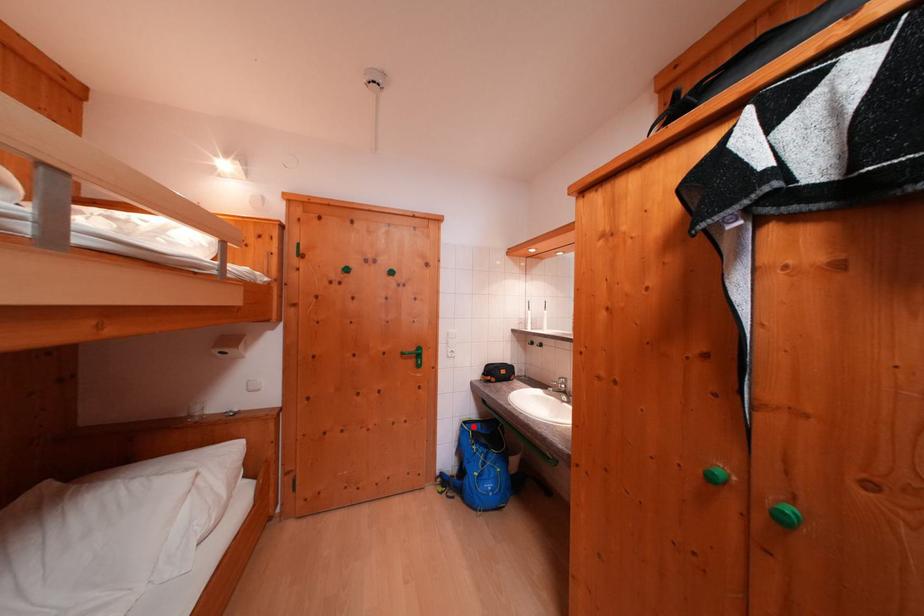
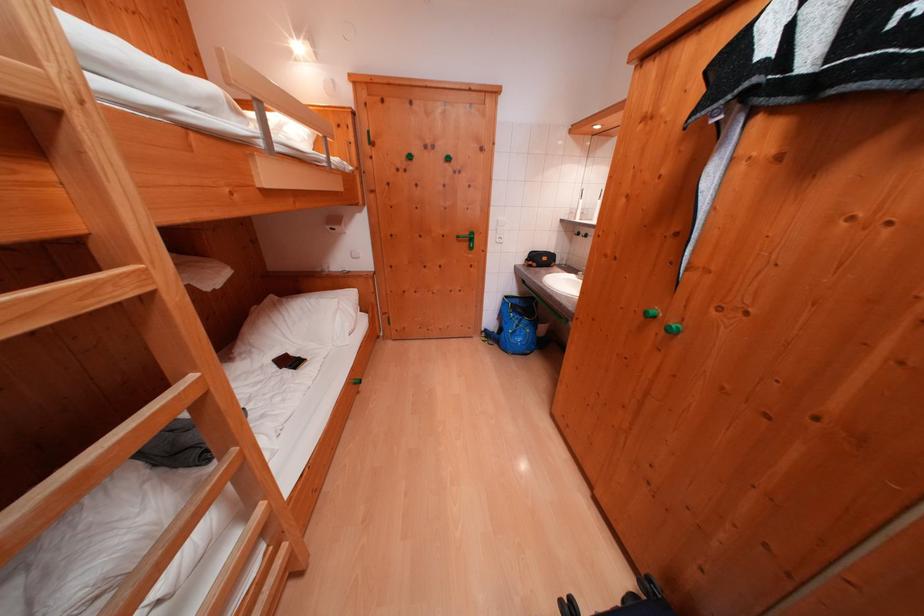
Question: A red point is marked in image1. In image2, is the corresponding 3D point closer to the camera or farther? Reply with the corresponding letter.

Choices:
 (A) The corresponding 3D point is closer.
 (B) The corresponding 3D point is farther.

Answer: (A)